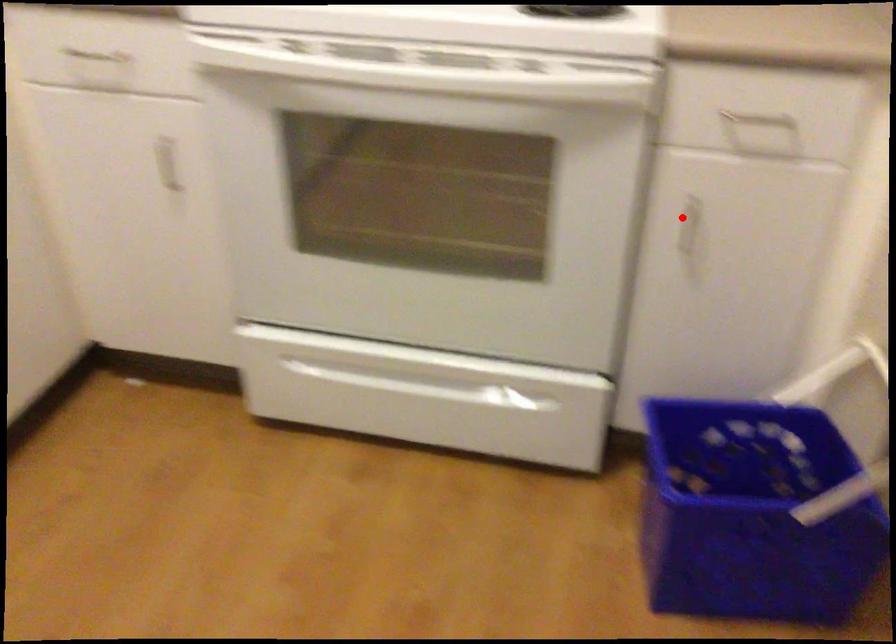
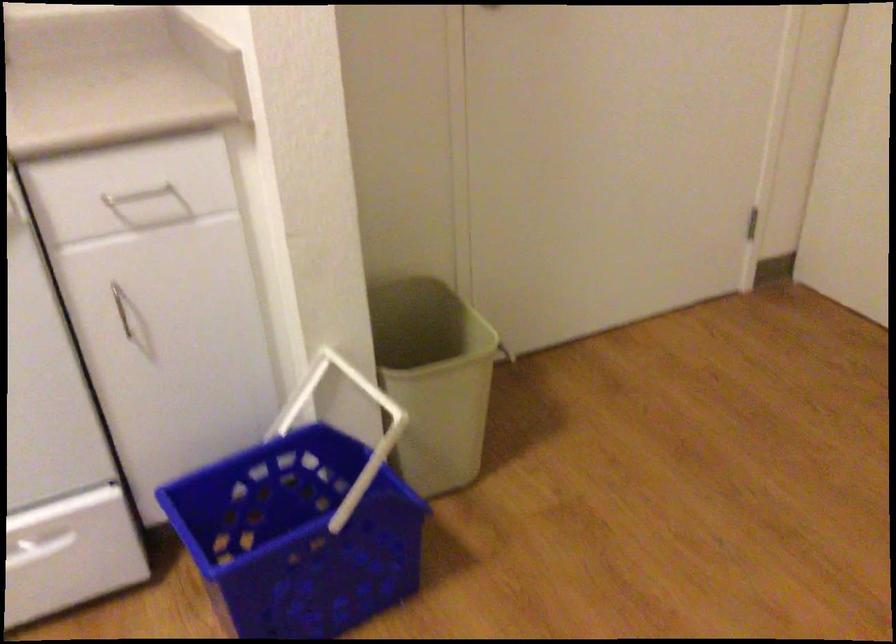
Where in the second image is the point corresponding to the highlighted location from the first image?

(121, 307)